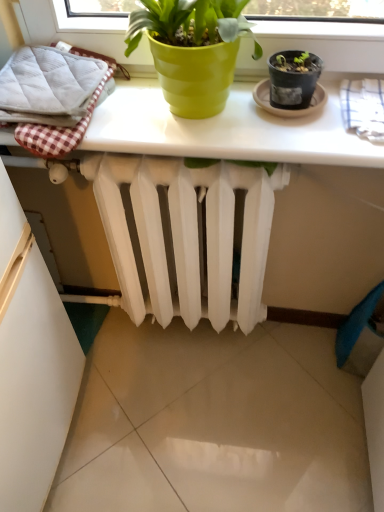
Question: Is white matte radiator at center surrounded by white glossy table at upper center?

Choices:
 (A) yes
 (B) no

Answer: (B)

Question: Would you consider white glossy table at upper center to be distant from white matte radiator at center?

Choices:
 (A) yes
 (B) no

Answer: (B)

Question: Can you confirm if white glossy table at upper center is thinner than white matte radiator at center?

Choices:
 (A) yes
 (B) no

Answer: (B)

Question: From a real-world perspective, is white glossy table at upper center located beneath white matte radiator at center?

Choices:
 (A) no
 (B) yes

Answer: (A)

Question: Considering the relative sizes of white glossy table at upper center and white matte radiator at center in the image provided, is white glossy table at upper center smaller than white matte radiator at center?

Choices:
 (A) no
 (B) yes

Answer: (B)

Question: Considering their positions, is white checkered bath towel at upper right, positioned as the second bath towel in left-to-right order, located in front of or behind white glossy table at upper center?

Choices:
 (A) behind
 (B) front

Answer: (B)

Question: Is white checkered bath towel at upper right, positioned as the first bath towel in right-to-left order, spatially inside white glossy table at upper center, or outside of it?

Choices:
 (A) inside
 (B) outside

Answer: (B)

Question: Looking at their shapes, would you say white checkered bath towel at upper right, positioned as the first bath towel in right-to-left order, is wider or thinner than white glossy table at upper center?

Choices:
 (A) wide
 (B) thin

Answer: (B)

Question: From the image's perspective, is white checkered bath towel at upper right, positioned as the first bath towel in right-to-left order, located above or below white glossy table at upper center?

Choices:
 (A) above
 (B) below

Answer: (B)

Question: Is white checkered bath towel at upper right, positioned as the first bath towel in right-to-left order, inside the boundaries of white quilted bath towel at left, acting as the 1th bath towel starting from the left, or outside?

Choices:
 (A) outside
 (B) inside

Answer: (A)

Question: Would you say white checkered bath towel at upper right, positioned as the first bath towel in right-to-left order, is to the left or to the right of white quilted bath towel at left, the second bath towel viewed from the right, in the picture?

Choices:
 (A) left
 (B) right

Answer: (B)

Question: Considering the positions of white checkered bath towel at upper right, positioned as the first bath towel in right-to-left order, and white quilted bath towel at left, the second bath towel viewed from the right, in the image, is white checkered bath towel at upper right, positioned as the first bath towel in right-to-left order, wider or thinner than white quilted bath towel at left, the second bath towel viewed from the right,?

Choices:
 (A) thin
 (B) wide

Answer: (A)

Question: From a real-world perspective, is white checkered bath towel at upper right, positioned as the second bath towel in left-to-right order, positioned above or below white quilted bath towel at left, the second bath towel viewed from the right?

Choices:
 (A) below
 (B) above

Answer: (A)

Question: Relative to white glossy table at upper center, is white matte radiator at center in front or behind?

Choices:
 (A) behind
 (B) front

Answer: (A)

Question: Considering the positions of white matte radiator at center and white glossy table at upper center in the image, is white matte radiator at center taller or shorter than white glossy table at upper center?

Choices:
 (A) tall
 (B) short

Answer: (A)